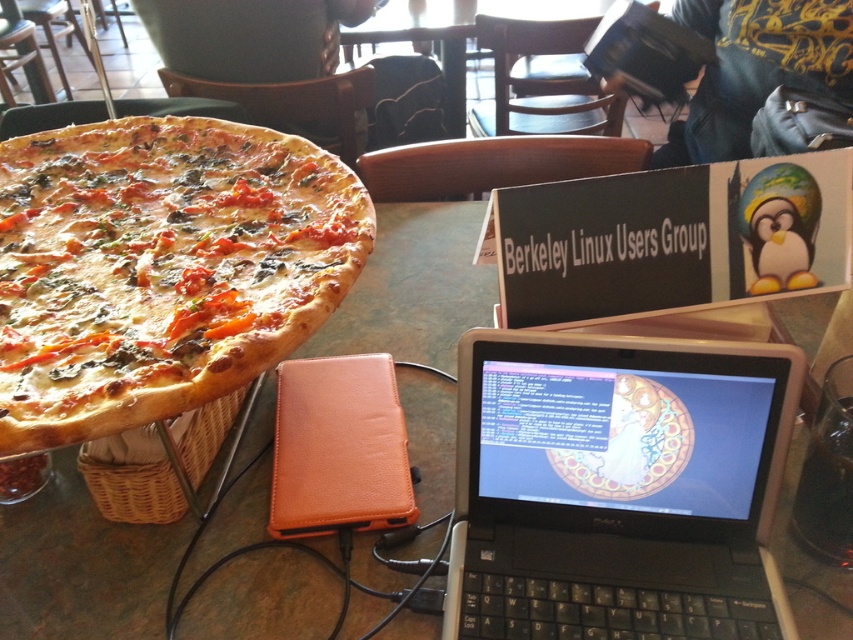
Can you confirm if golden brown crusty pizza at left is shorter than brown leather table at center?

Yes.

From the picture: Does golden brown crusty pizza at left lie in front of brown leather table at center?

Yes, it is in front of brown leather table at center.

Identify the location of golden brown crusty pizza at left. (160, 268).

Is black plastic laptop at center further to the viewer compared to brown leather table at center?

No, it is not.

Who is more distant from viewer, (653, 403) or (456, 204)?

Point (456, 204)

Does point (468, 451) come closer to viewer compared to point (352, 346)?

Yes, point (468, 451) is closer to viewer.

Find the location of `black plastic laptop at center`. black plastic laptop at center is located at coordinates (618, 488).

Can you confirm if black plastic laptop at center is shorter than golden brown crusty pizza at left?

Indeed, black plastic laptop at center has a lesser height compared to golden brown crusty pizza at left.

Who is shorter, black plastic laptop at center or golden brown crusty pizza at left?

black plastic laptop at center is shorter.

Locate an element on the screen. black plastic laptop at center is located at coordinates (618, 488).